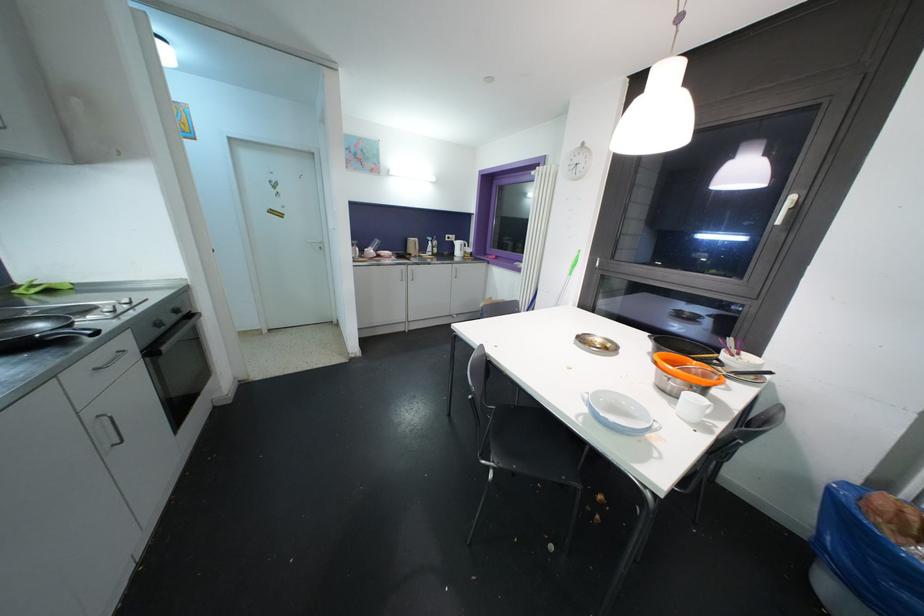
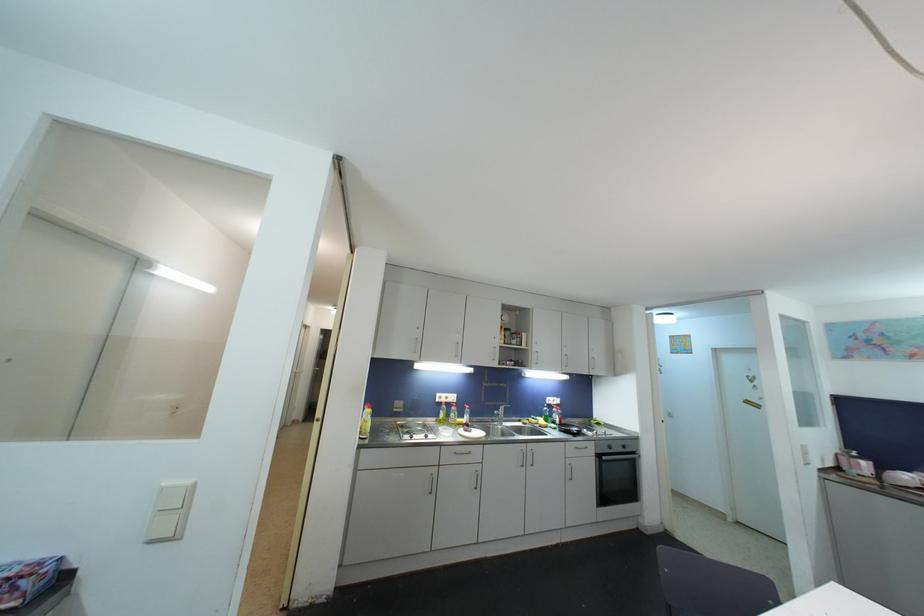
The point at (x=91, y=421) is marked in the first image. Where is the corresponding point in the second image?

(570, 464)